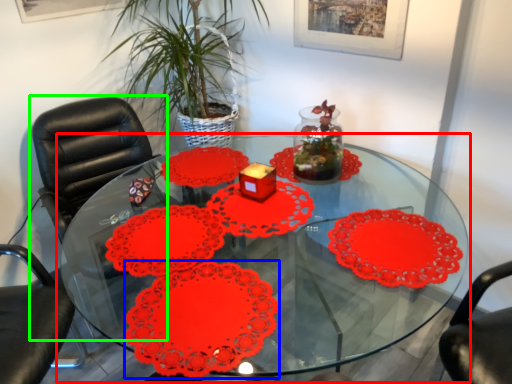
Question: Estimate the real-world distances between objects in this image. Which object is farther from table (highlighted by a red box), flower (highlighted by a blue box) or chair (highlighted by a green box)?

Choices:
 (A) flower
 (B) chair

Answer: (B)